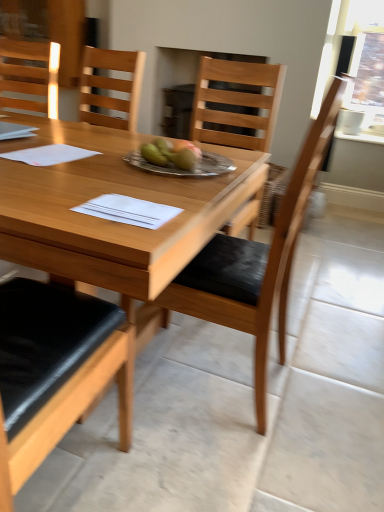
Question: Is wooden chair at center, the 2th chair in the left-to-right sequence, far from silver metallic plate at center?

Choices:
 (A) yes
 (B) no

Answer: (B)

Question: Considering the relative sizes of wooden chair at center, which appears as the 1th chair when viewed from the right, and silver metallic plate at center in the image provided, is wooden chair at center, which appears as the 1th chair when viewed from the right, wider than silver metallic plate at center?

Choices:
 (A) yes
 (B) no

Answer: (A)

Question: Would you say silver metallic plate at center is part of wooden chair at center, the first chair ordered from the bottom,'s contents?

Choices:
 (A) yes
 (B) no

Answer: (A)

Question: From a real-world perspective, is wooden chair at center, the 1th chair from the front, located higher than silver metallic plate at center?

Choices:
 (A) yes
 (B) no

Answer: (B)

Question: Is wooden chair at center, the 1th chair from the front, positioned behind silver metallic plate at center?

Choices:
 (A) yes
 (B) no

Answer: (B)

Question: Is wooden chair at center, the 2th chair in the left-to-right sequence, completely or partially outside of silver metallic plate at center?

Choices:
 (A) no
 (B) yes

Answer: (B)

Question: Does wooden table at center contain wooden chair at center, marked as the second chair in a top-to-bottom arrangement?

Choices:
 (A) no
 (B) yes

Answer: (B)

Question: Considering the relative sizes of wooden table at center and wooden chair at center, the 1th chair from the front, in the image provided, is wooden table at center taller than wooden chair at center, the 1th chair from the front,?

Choices:
 (A) no
 (B) yes

Answer: (A)

Question: Considering the relative positions of wooden table at center and wooden chair at center, which appears as the 1th chair when viewed from the right, in the image provided, is wooden table at center to the right of wooden chair at center, which appears as the 1th chair when viewed from the right, from the viewer's perspective?

Choices:
 (A) yes
 (B) no

Answer: (B)

Question: Is wooden table at center positioned in front of wooden chair at center, the 2th chair in the left-to-right sequence?

Choices:
 (A) yes
 (B) no

Answer: (A)

Question: From the image's perspective, is wooden table at center located above wooden chair at center, marked as the second chair in a top-to-bottom arrangement?

Choices:
 (A) yes
 (B) no

Answer: (A)

Question: Is wooden table at center facing away from wooden chair at center, which appears as the 1th chair when viewed from the right?

Choices:
 (A) no
 (B) yes

Answer: (B)

Question: Are wooden chair at center, the 2th chair in the left-to-right sequence, and matte wood chair at upper left, the second chair in the front-to-back sequence, located far from each other?

Choices:
 (A) yes
 (B) no

Answer: (A)